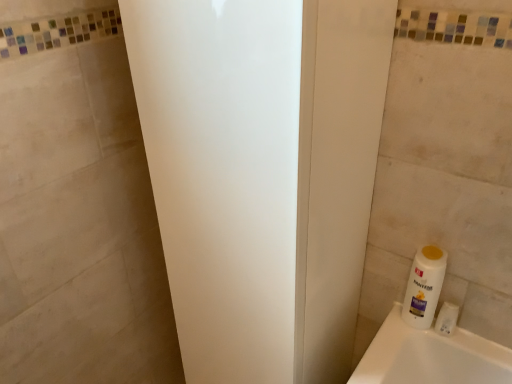
Question: Could you tell me if white plastic bottle at lower right is facing white matte screen door at center?

Choices:
 (A) yes
 (B) no

Answer: (B)

Question: Can you confirm if white plastic bottle at lower right is shorter than white matte screen door at center?

Choices:
 (A) no
 (B) yes

Answer: (B)

Question: Can you confirm if white plastic bottle at lower right is wider than white matte screen door at center?

Choices:
 (A) no
 (B) yes

Answer: (A)

Question: Is white plastic bottle at lower right positioned in front of white matte screen door at center?

Choices:
 (A) yes
 (B) no

Answer: (B)

Question: Is white plastic bottle at lower right bigger than white matte screen door at center?

Choices:
 (A) yes
 (B) no

Answer: (B)

Question: Is white plastic bottle at lower right turned away from white matte screen door at center?

Choices:
 (A) yes
 (B) no

Answer: (B)

Question: Is white matte screen door at center beside white plastic bottle at lower right?

Choices:
 (A) yes
 (B) no

Answer: (B)

Question: Is white matte screen door at center facing towards white plastic bottle at lower right?

Choices:
 (A) no
 (B) yes

Answer: (A)

Question: From a real-world perspective, is white matte screen door at center located higher than white plastic bottle at lower right?

Choices:
 (A) no
 (B) yes

Answer: (A)

Question: From a real-world perspective, is white matte screen door at center below white plastic bottle at lower right?

Choices:
 (A) yes
 (B) no

Answer: (A)

Question: Is white matte screen door at center positioned before white plastic bottle at lower right?

Choices:
 (A) yes
 (B) no

Answer: (A)

Question: From the image's perspective, would you say white matte screen door at center is shown under white plastic bottle at lower right?

Choices:
 (A) yes
 (B) no

Answer: (B)

Question: Is white plastic bottle at lower right far away from white matte screen door at center?

Choices:
 (A) no
 (B) yes

Answer: (A)